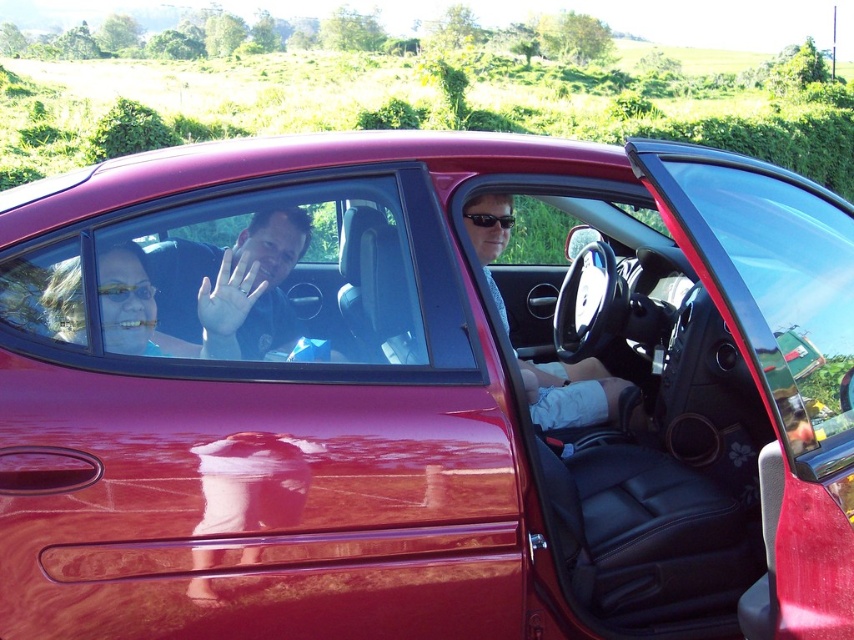
Question: Can you confirm if matte blue shirt at center is wider than gold reflective goggles at center?

Choices:
 (A) yes
 (B) no

Answer: (A)

Question: Is clear glass window at center positioned at the back of transparent glass door at center?

Choices:
 (A) yes
 (B) no

Answer: (A)

Question: Estimate the real-world distances between objects in this image. Which object is closer to the transparent glass door at center?

Choices:
 (A) gold reflective goggles at center
 (B) black plastic sunglasses at center
 (C) satin black shirt at center

Answer: (B)

Question: Can you confirm if transparent glass door at center is positioned to the right of matte blue shirt at center?

Choices:
 (A) yes
 (B) no

Answer: (A)

Question: Which object is closer to the camera taking this photo?

Choices:
 (A) satin black shirt at center
 (B) clear glass window at center
 (C) transparent glass door at center

Answer: (C)

Question: Which point is farther to the camera?

Choices:
 (A) (162, 291)
 (B) (506, 221)

Answer: (B)